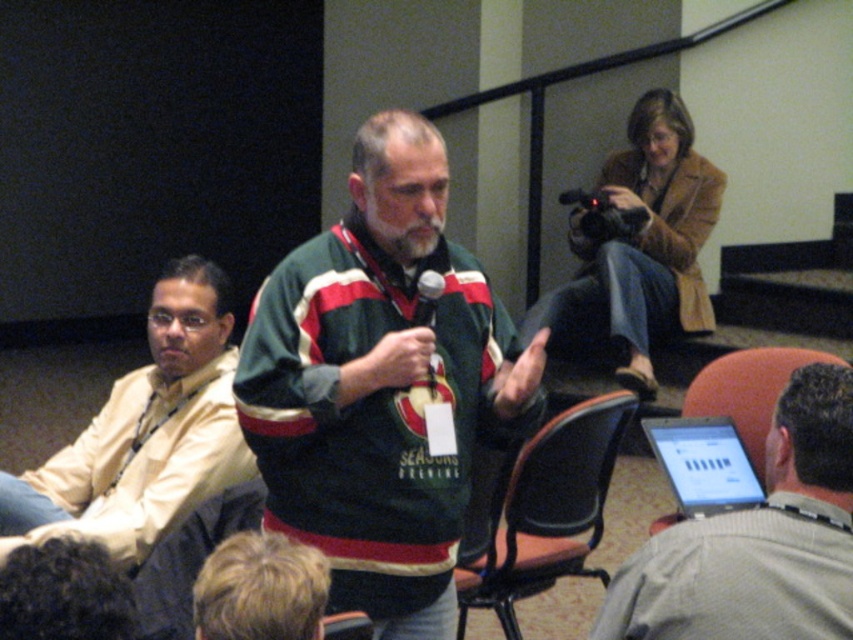
Question: Which of the following is the farthest from the observer?

Choices:
 (A) green knit sweater at center
 (B) gray fabric shirt at lower right

Answer: (A)

Question: Observing the image, what is the correct spatial positioning of brown leather chair at lower right in reference to silver metallic laptop at lower right?

Choices:
 (A) below
 (B) above

Answer: (A)

Question: Can you confirm if gray fabric shirt at lower right is bigger than brown leather chair at lower right?

Choices:
 (A) yes
 (B) no

Answer: (B)

Question: Which point is farther from the camera taking this photo?

Choices:
 (A) (787, 417)
 (B) (573, 500)
 (C) (341, 634)

Answer: (B)

Question: Which is nearer to the beige fabric suit at left?

Choices:
 (A) gray fabric shirt at lower right
 (B) matte brown leather camera at upper right
 (C) green knit sweater at center
 (D) brown leather chair at lower center

Answer: (C)

Question: Is silver metallic laptop at lower right wider than orange fabric chair at lower right?

Choices:
 (A) no
 (B) yes

Answer: (A)